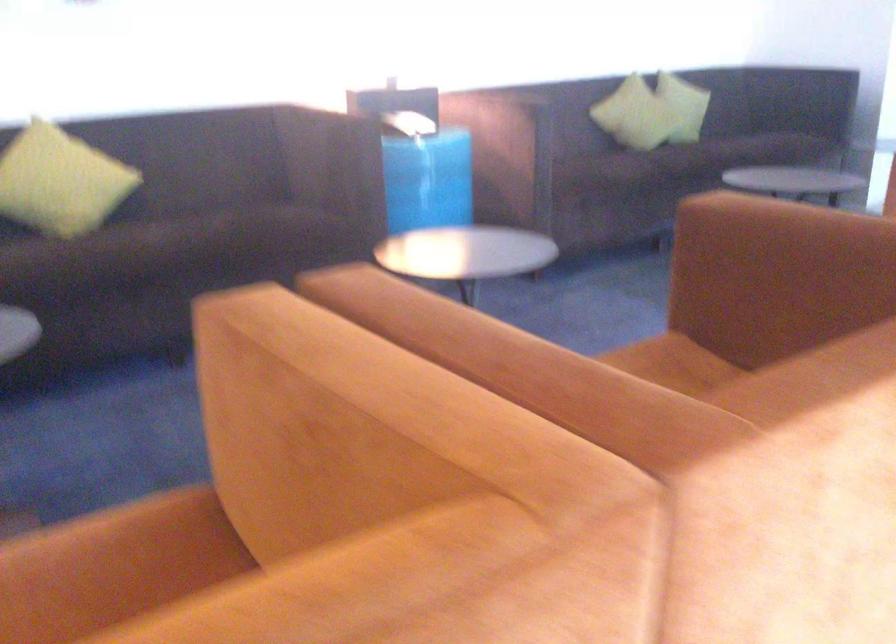
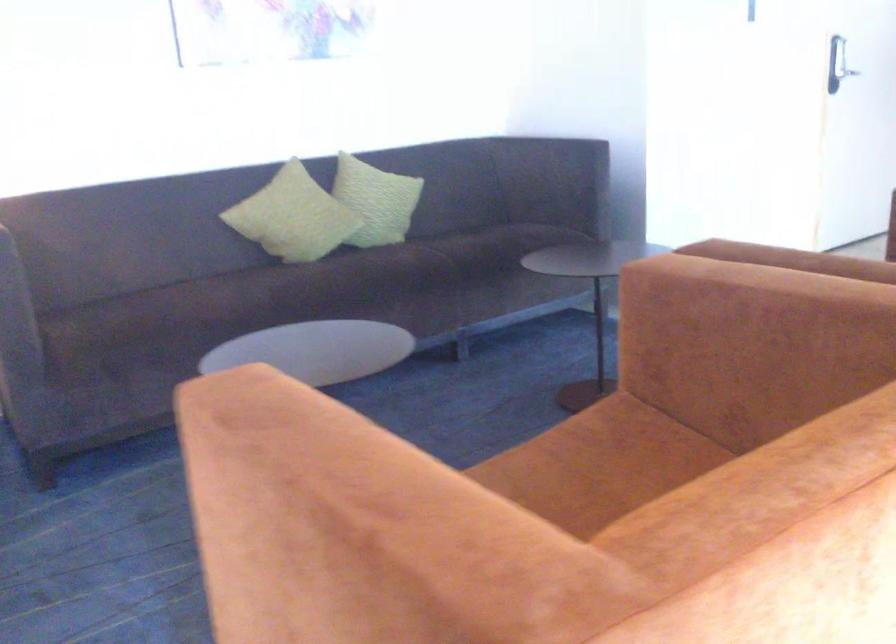
Find the pixel in the second image that matches point (688, 149) in the first image.

(270, 290)